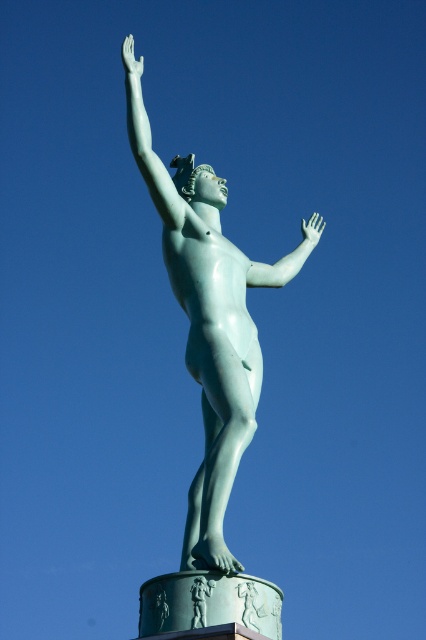
Question: Estimate the real-world distances between objects in this image. Which object is closer to the green polished statue arm at upper left?

Choices:
 (A) green polished stone pedestal at lower center
 (B) green patina statue at center
 (C) smooth white arm at center

Answer: (B)

Question: Is green polished stone pedestal at lower center positioned at the back of smooth white arm at center?

Choices:
 (A) no
 (B) yes

Answer: (A)

Question: Is green patina statue at center bigger than green polished stone pedestal at lower center?

Choices:
 (A) no
 (B) yes

Answer: (B)

Question: Which point is farther from the camera taking this photo?

Choices:
 (A) (284, 260)
 (B) (204, 572)
 (C) (216, 365)
 (D) (143, 176)

Answer: (A)

Question: Which object appears farthest from the camera in this image?

Choices:
 (A) green patina statue at center
 (B) smooth white arm at center
 (C) green polished statue arm at upper left

Answer: (B)

Question: From the image, what is the correct spatial relationship of green polished stone pedestal at lower center in relation to smooth white arm at center?

Choices:
 (A) right
 (B) left

Answer: (B)